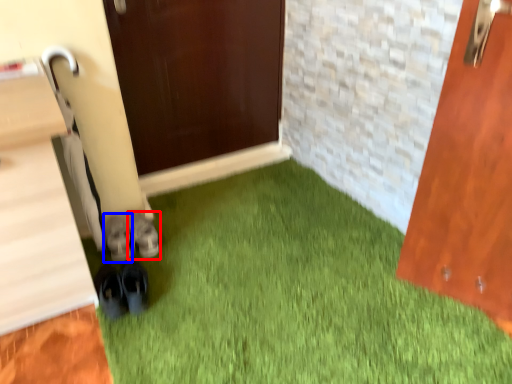
Question: Among these objects, which one is farthest to the camera, footwear (highlighted by a red box) or footwear (highlighted by a blue box)?

Choices:
 (A) footwear
 (B) footwear

Answer: (A)